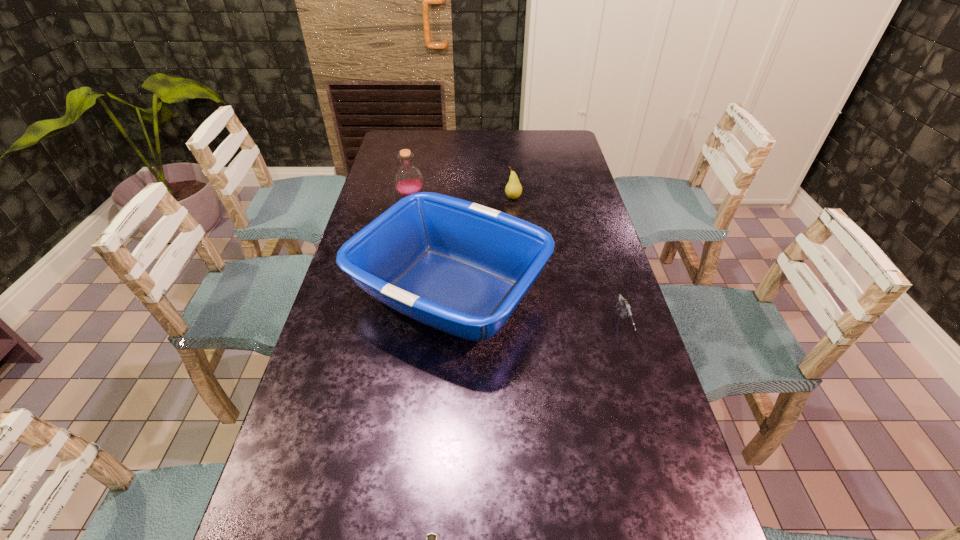
Where is `tray at the left edge`? This screenshot has width=960, height=540. tray at the left edge is located at coordinates (460, 267).

Identify the location of object present at the right edge. (623, 304).

Locate an element on the screen. free space at the far edge is located at coordinates (534, 145).

Locate an element on the screen. vacant area at the left edge is located at coordinates (390, 181).

The height and width of the screenshot is (540, 960). Identify the location of free space at the right edge of the desktop. (571, 206).

Find the location of a particular element. The height and width of the screenshot is (540, 960). blank area at the far left corner is located at coordinates (399, 147).

Locate an element on the screen. The height and width of the screenshot is (540, 960). vacant region at the far right corner is located at coordinates (549, 132).

Locate an element on the screen. Image resolution: width=960 pixels, height=540 pixels. vacant space that's between the pear and the bottle is located at coordinates (462, 198).

Find the location of `vacant region between the third tallest object and the farther gun`. vacant region between the third tallest object and the farther gun is located at coordinates (568, 262).

The height and width of the screenshot is (540, 960). I want to click on vacant space that is in between the right gun and the tray, so tap(537, 309).